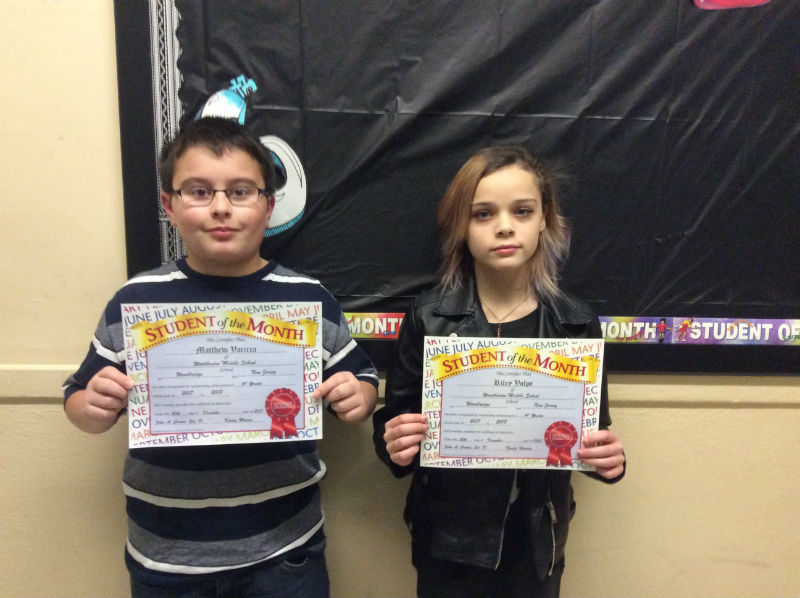
I want to click on papers, so click(510, 392).